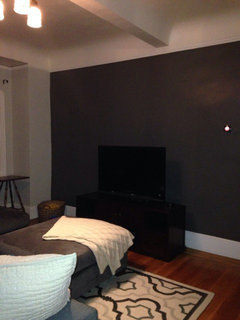
Locate an element on the screen. blanket is located at coordinates (70, 229), (102, 256), (105, 236).